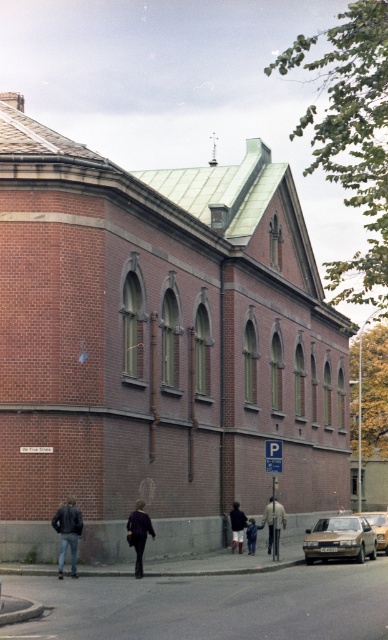
Can you confirm if jeans at lower left is smaller than silver metallic car at lower right?

Indeed, jeans at lower left has a smaller size compared to silver metallic car at lower right.

Is jeans at lower left positioned at the back of silver metallic car at lower right?

No, it is not.

What do you see at coordinates (67, 532) in the screenshot?
I see `jeans at lower left` at bounding box center [67, 532].

This screenshot has width=388, height=640. Identify the location of jeans at lower left. (67, 532).

Between dark purple jacket at center and silver metallic car at lower right, which one is positioned higher?

dark purple jacket at center

Is dark purple jacket at center behind silver metallic car at lower right?

No, it is in front of silver metallic car at lower right.

Between point (150, 520) and point (382, 547), which one is positioned in front?

Point (150, 520) is in front.

Locate an element on the screen. dark purple jacket at center is located at coordinates (138, 532).

Which is more to the right, dark blue jeans at center or dark blue jeans at lower center?

Positioned to the right is dark blue jeans at lower center.

Who is positioned more to the left, dark blue jeans at center or dark blue jeans at lower center?

dark blue jeans at center is more to the left.

Between point (235, 541) and point (251, 554), which one is positioned behind?

Positioned behind is point (235, 541).

The width and height of the screenshot is (388, 640). Identify the location of dark blue jeans at center. (237, 525).